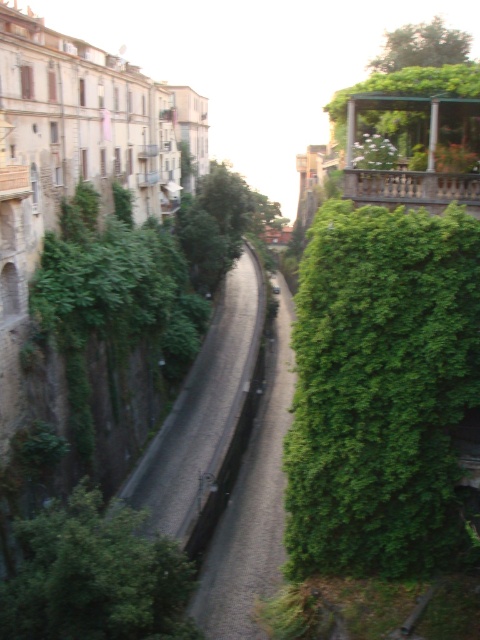
Question: Which object is farther from the camera taking this photo?

Choices:
 (A) green leafy tree at upper center
 (B) green leafy hedge at lower left
 (C) green leafy hedge at right

Answer: (A)

Question: Which of the following is the closest to the observer?

Choices:
 (A) (431, 28)
 (B) (94, 499)
 (C) (346, 364)

Answer: (B)

Question: Which of these objects is positioned farthest from the green leafy hedge at lower left?

Choices:
 (A) green leafy hedge at right
 (B) green leafy tree at upper center

Answer: (B)

Question: From the image, what is the correct spatial relationship of green leafy hedge at lower left in relation to green leafy tree at upper center?

Choices:
 (A) above
 (B) below

Answer: (B)

Question: Is green leafy hedge at right smaller than green leafy tree at upper center?

Choices:
 (A) no
 (B) yes

Answer: (B)

Question: Is green leafy hedge at right positioned in front of green leafy tree at upper center?

Choices:
 (A) no
 (B) yes

Answer: (B)